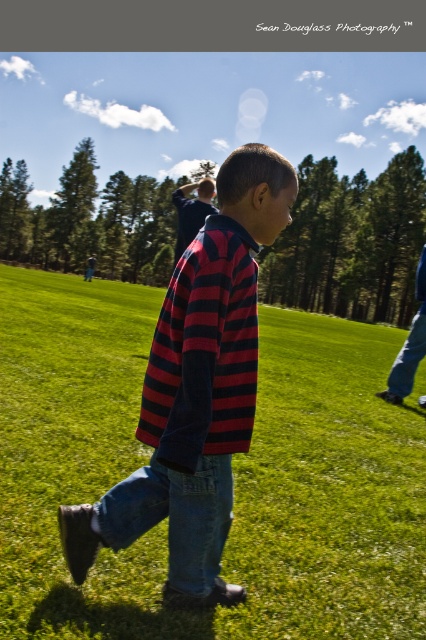
Question: Which is farther from the denim jeans at lower right?

Choices:
 (A) green grass at center
 (B) denim jeans at center

Answer: (A)

Question: Does green grass at center have a larger size compared to denim jeans at lower right?

Choices:
 (A) yes
 (B) no

Answer: (A)

Question: Can you confirm if green grass at center is thinner than striped cotton shirt at center?

Choices:
 (A) yes
 (B) no

Answer: (B)

Question: Which point appears farthest from the camera in this image?

Choices:
 (A) (408, 342)
 (B) (226, 256)

Answer: (A)

Question: Which point appears farthest from the camera in this image?

Choices:
 (A) (103, 529)
 (B) (152, 332)
 (C) (201, 518)
 (D) (419, 340)

Answer: (B)

Question: Is striped cotton shirt at center thinner than denim jeans at center?

Choices:
 (A) no
 (B) yes

Answer: (A)